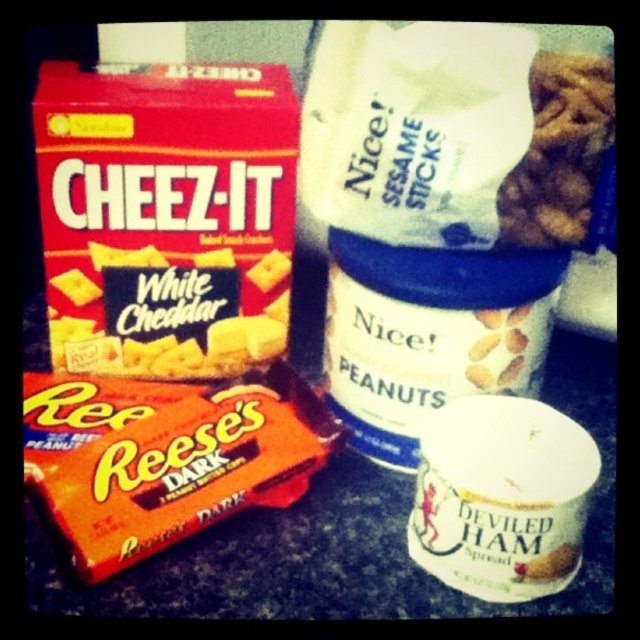
Question: Which of these objects is positioned closest to the white matte deviled ham spread at lower right?

Choices:
 (A) brown crumbly cookie at upper right
 (B) orange wrapper chocolate at center
 (C) white cheddar cheese at upper left

Answer: (B)

Question: Which object is farther from the camera taking this photo?

Choices:
 (A) white cheddar cheez-it at left
 (B) white matte deviled ham spread at lower right
 (C) brown crumbly cookie at upper right

Answer: (A)

Question: Is white cheddar cheez-it at left further to camera compared to white cheddar cheese at upper left?

Choices:
 (A) no
 (B) yes

Answer: (A)

Question: Is white cheddar cheese at upper left to the left of brown crumbly cookie at upper right from the viewer's perspective?

Choices:
 (A) yes
 (B) no

Answer: (A)

Question: Is white matte deviled ham spread at lower right above white cheddar cheese at upper left?

Choices:
 (A) yes
 (B) no

Answer: (B)

Question: Which object is positioned closest to the white cheddar cheese at upper left?

Choices:
 (A) brown crumbly cookie at upper right
 (B) white matte deviled ham spread at lower right
 (C) white cheddar cheez-it at left

Answer: (C)